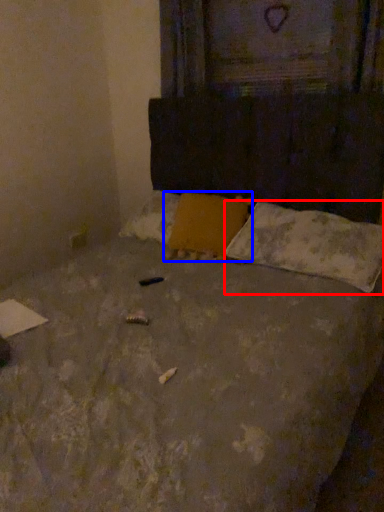
Question: Among these objects, which one is farthest to the camera, pillow (highlighted by a red box) or pillow (highlighted by a blue box)?

Choices:
 (A) pillow
 (B) pillow

Answer: (B)